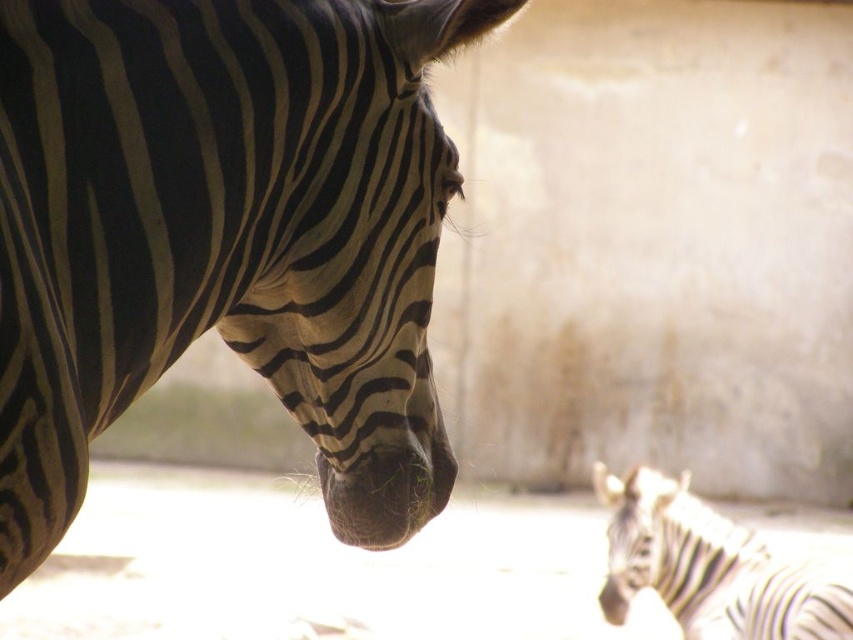
Question: Which point is farther to the camera?

Choices:
 (A) (384, 170)
 (B) (822, 637)
 (C) (624, 604)

Answer: (C)

Question: Does black and white striped zebra at left have a smaller size compared to black and white striped zebra at lower right?

Choices:
 (A) yes
 (B) no

Answer: (B)

Question: Which point is closer to the camera?

Choices:
 (A) (624, 593)
 (B) (836, 593)

Answer: (B)

Question: Does black and white striped zebra at left have a lesser width compared to black and white striped zebra at lower right?

Choices:
 (A) yes
 (B) no

Answer: (B)

Question: Estimate the real-world distances between objects in this image. Which object is closer to the black and white striped zebra at lower right?

Choices:
 (A) black and white striped zebra nose at lower right
 (B) black and white striped zebra at left

Answer: (A)

Question: In this image, where is black and white striped zebra at lower right located relative to black and white striped zebra nose at lower right?

Choices:
 (A) above
 (B) below

Answer: (A)